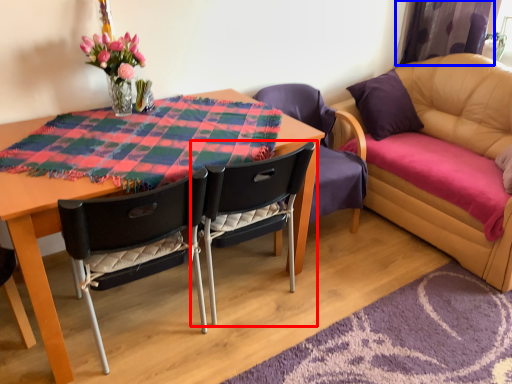
Question: Which point is further to the camera, chair (highlighted by a red box) or curtain (highlighted by a blue box)?

Choices:
 (A) chair
 (B) curtain

Answer: (B)